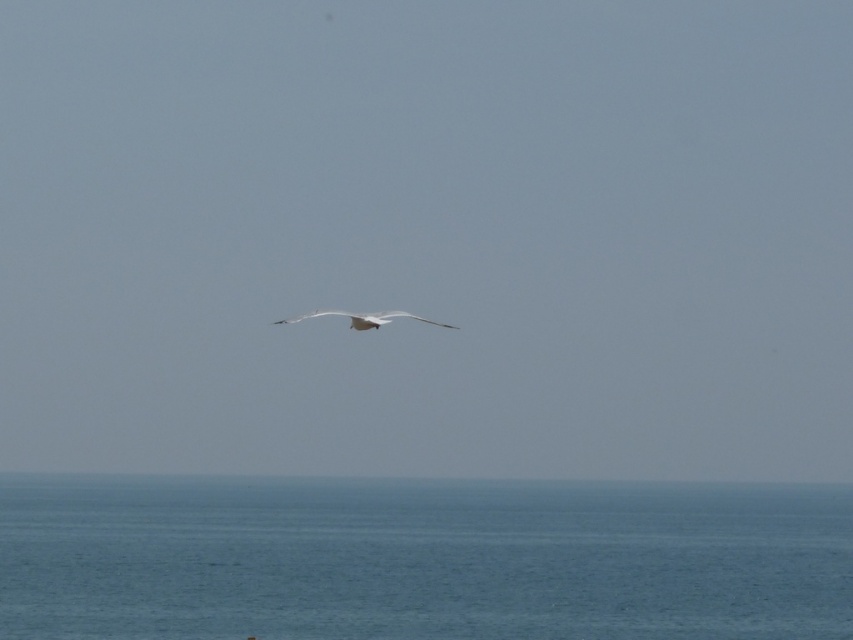
You are a drone operator trying to capture the horizon line in your shot. You notice a point at coordinates point (421, 561). Based on the scene, is this point above or below the horizon line?

The point at point (421, 561) is located at blue water at lower center, which is below the horizon line. Therefore, the point is below the horizon line.

You are a photographer standing at the center of the scene. You want to take a photo of both the point at point [198,602] and the point at point [352,321]. Which point is closer to your camera?

Point [352,321] is closer to the camera because it is less further than point [198,602].